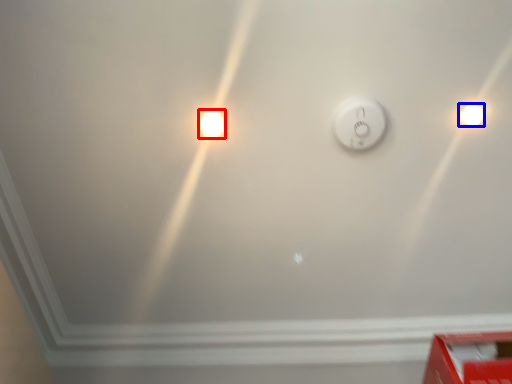
Question: Among these objects, which one is nearest to the camera, light bulb (highlighted by a red box) or light bulb (highlighted by a blue box)?

Choices:
 (A) light bulb
 (B) light bulb

Answer: (B)